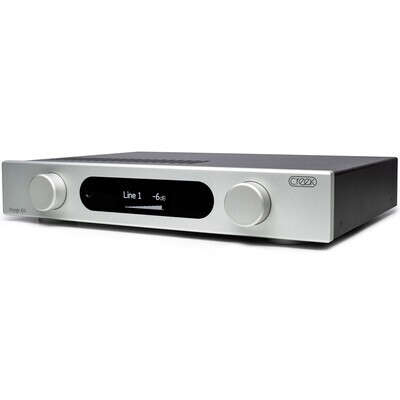
At what (x,y) coordinates should I click in order to perform the action: click on knobs. Please return your answer as a coordinate pair (x, y). The height and width of the screenshot is (400, 400). Looking at the image, I should click on 253,212, 38,198.